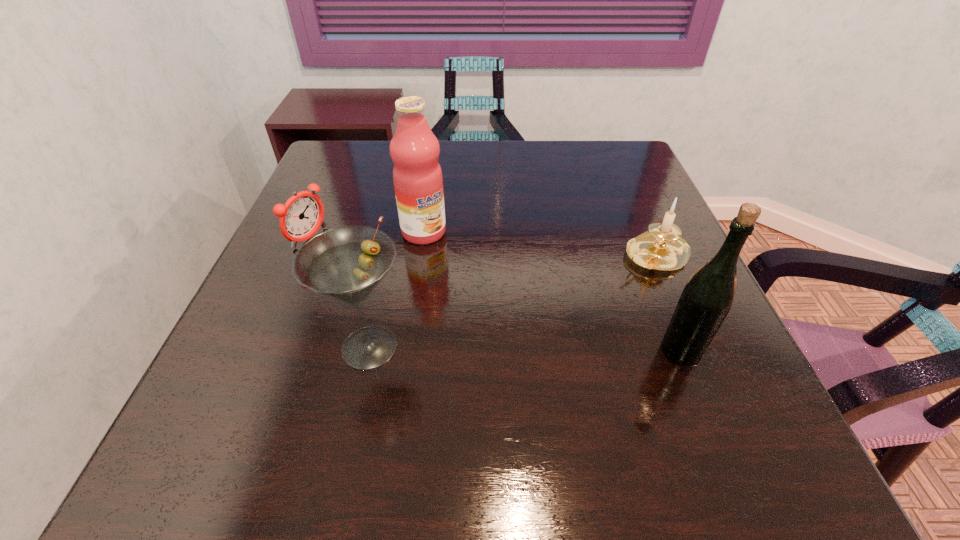
The height and width of the screenshot is (540, 960). What are the coordinates of `candle holder situated at the right edge` in the screenshot? It's located at (661, 248).

You are a GUI agent. You are given a task and a screenshot of the screen. Output one action in this format:
    pyautogui.click(x=<x>, y=<y>)
    Task: Click on the blank space at the far edge
    The width and height of the screenshot is (960, 540).
    Given the screenshot: What is the action you would take?
    pyautogui.click(x=529, y=140)

Image resolution: width=960 pixels, height=540 pixels. I want to click on free space at the left edge of the desktop, so click(276, 293).

At what (x,y) coordinates should I click in order to perform the action: click on vacant space at the right edge of the desktop. Please return your answer as a coordinate pair (x, y). Looking at the image, I should click on (661, 302).

Where is `vacant region at the near left corner of the desktop`? The image size is (960, 540). vacant region at the near left corner of the desktop is located at coordinates (253, 393).

You are a GUI agent. You are given a task and a screenshot of the screen. Output one action in this format:
    pyautogui.click(x=<x>, y=<y>)
    Task: Click on the free space at the far right corner
    Image resolution: width=960 pixels, height=540 pixels.
    Given the screenshot: What is the action you would take?
    pyautogui.click(x=642, y=167)

Identify the location of free spot between the beer bottle and the candle holder. The width and height of the screenshot is (960, 540). (667, 302).

In order to click on empty space between the fruit juice and the candle holder in this screenshot , I will do `click(539, 244)`.

The image size is (960, 540). In order to click on vacant space that is in between the candle holder and the beer bottle in this screenshot , I will do `click(667, 302)`.

I want to click on free area in between the fruit juice and the third tallest object, so click(x=396, y=289).